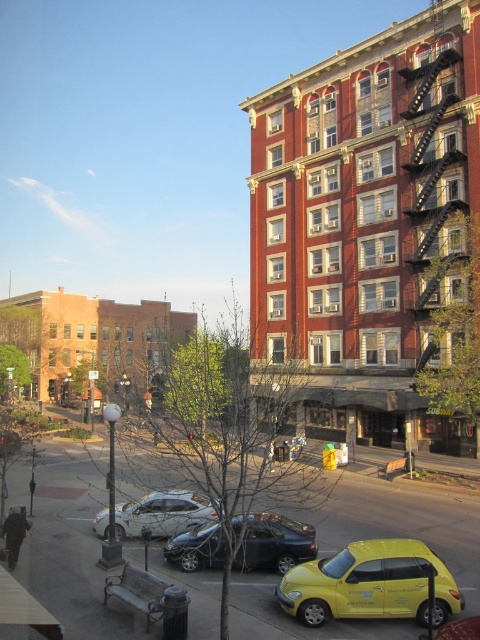
Question: Which of the following is the farthest from the observer?

Choices:
 (A) (272, 568)
 (B) (418, 548)

Answer: (A)

Question: Is yellow matte hatchback at lower right closer to camera compared to shiny black sedan at center?

Choices:
 (A) no
 (B) yes

Answer: (B)

Question: Is shiny black sedan at center positioned at the back of silver metallic sedan at center?

Choices:
 (A) yes
 (B) no

Answer: (B)

Question: Which point is closer to the camera?

Choices:
 (A) (349, 605)
 (B) (312, 538)
 (C) (145, 506)

Answer: (A)

Question: Is yellow matte hatchback at lower right positioned behind shiny black sedan at center?

Choices:
 (A) no
 (B) yes

Answer: (A)

Question: Which of the following is the closest to the observer?

Choices:
 (A) shiny black sedan at center
 (B) yellow matte hatchback at lower right
 (C) silver metallic sedan at center

Answer: (B)